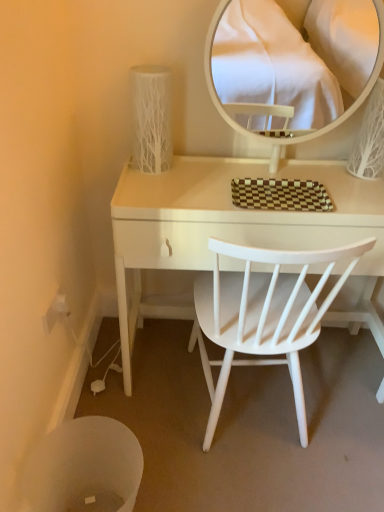
Find the location of a particular element. This screenshot has width=384, height=512. free point below white glossy mirror at upper center (from a real-world perspective) is located at coordinates (288, 172).